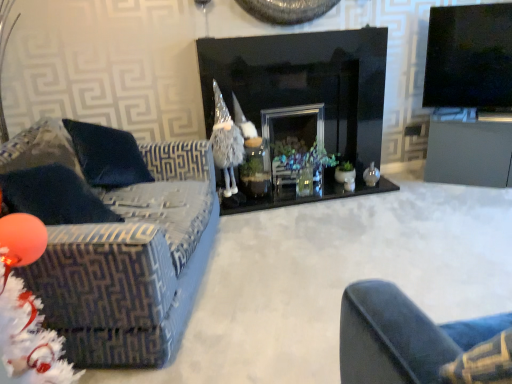
Question: Is black glass fireplace at center placed right next to velvet-patterned couch at left?

Choices:
 (A) no
 (B) yes

Answer: (A)

Question: Could you tell me if black glass fireplace at center is turned towards velvet-patterned couch at left?

Choices:
 (A) yes
 (B) no

Answer: (B)

Question: Does black glass fireplace at center come in front of velvet-patterned couch at left?

Choices:
 (A) yes
 (B) no

Answer: (B)

Question: Is black glass fireplace at center completely or partially outside of velvet-patterned couch at left?

Choices:
 (A) yes
 (B) no

Answer: (A)

Question: Does black glass fireplace at center have a greater height compared to velvet-patterned couch at left?

Choices:
 (A) yes
 (B) no

Answer: (A)

Question: Is black glass fireplace at center surrounding velvet-patterned couch at left?

Choices:
 (A) yes
 (B) no

Answer: (B)

Question: Is matte gray table at right far away from velvet-patterned couch at left?

Choices:
 (A) yes
 (B) no

Answer: (A)

Question: From a real-world perspective, is matte gray table at right located higher than velvet-patterned couch at left?

Choices:
 (A) no
 (B) yes

Answer: (A)

Question: Considering the relative sizes of matte gray table at right and velvet-patterned couch at left in the image provided, is matte gray table at right shorter than velvet-patterned couch at left?

Choices:
 (A) no
 (B) yes

Answer: (B)

Question: Considering the relative sizes of matte gray table at right and velvet-patterned couch at left in the image provided, is matte gray table at right bigger than velvet-patterned couch at left?

Choices:
 (A) yes
 (B) no

Answer: (B)

Question: Is the position of matte gray table at right less distant than that of velvet-patterned couch at left?

Choices:
 (A) yes
 (B) no

Answer: (B)

Question: From the image's perspective, would you say matte gray table at right is positioned over velvet-patterned couch at left?

Choices:
 (A) yes
 (B) no

Answer: (A)

Question: Does black glass fireplace at center touch black glossy tv at upper right?

Choices:
 (A) no
 (B) yes

Answer: (A)